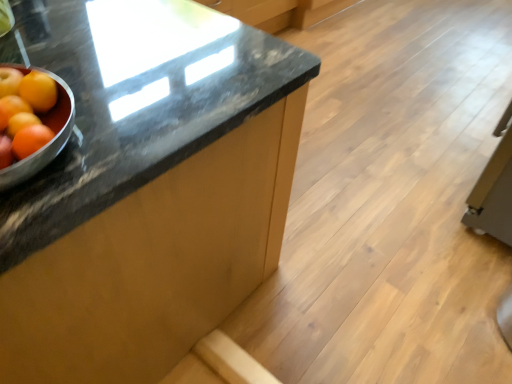
Question: Is orange matte at left at the right side of orange matte grapefruit at left?

Choices:
 (A) yes
 (B) no

Answer: (B)

Question: From the image's perspective, is orange matte at left below orange matte grapefruit at left?

Choices:
 (A) yes
 (B) no

Answer: (B)

Question: Could you tell me if orange matte at left is facing orange matte grapefruit at left?

Choices:
 (A) yes
 (B) no

Answer: (B)

Question: Considering the relative positions of orange matte at left and orange matte grapefruit at left in the image provided, is orange matte at left to the left of orange matte grapefruit at left from the viewer's perspective?

Choices:
 (A) no
 (B) yes

Answer: (B)

Question: Considering the relative positions of orange matte at left and orange matte grapefruit at left in the image provided, is orange matte at left in front of orange matte grapefruit at left?

Choices:
 (A) yes
 (B) no

Answer: (B)

Question: From a real-world perspective, is orange matte at left located beneath orange matte grapefruit at left?

Choices:
 (A) yes
 (B) no

Answer: (A)

Question: Is black granite countertop at center taller than orange matte grapefruit at left?

Choices:
 (A) yes
 (B) no

Answer: (A)

Question: From a real-world perspective, is black granite countertop at center positioned over orange matte grapefruit at left based on gravity?

Choices:
 (A) no
 (B) yes

Answer: (A)

Question: Is black granite countertop at center in front of orange matte grapefruit at left?

Choices:
 (A) yes
 (B) no

Answer: (A)

Question: Is orange matte grapefruit at left completely or partially inside black granite countertop at center?

Choices:
 (A) no
 (B) yes

Answer: (A)

Question: Can you confirm if black granite countertop at center is wider than orange matte grapefruit at left?

Choices:
 (A) no
 (B) yes

Answer: (B)

Question: Does black granite countertop at center appear on the left side of orange matte grapefruit at left?

Choices:
 (A) no
 (B) yes

Answer: (B)

Question: From a real-world perspective, is orange matte at left on top of orange matte at left?

Choices:
 (A) no
 (B) yes

Answer: (A)